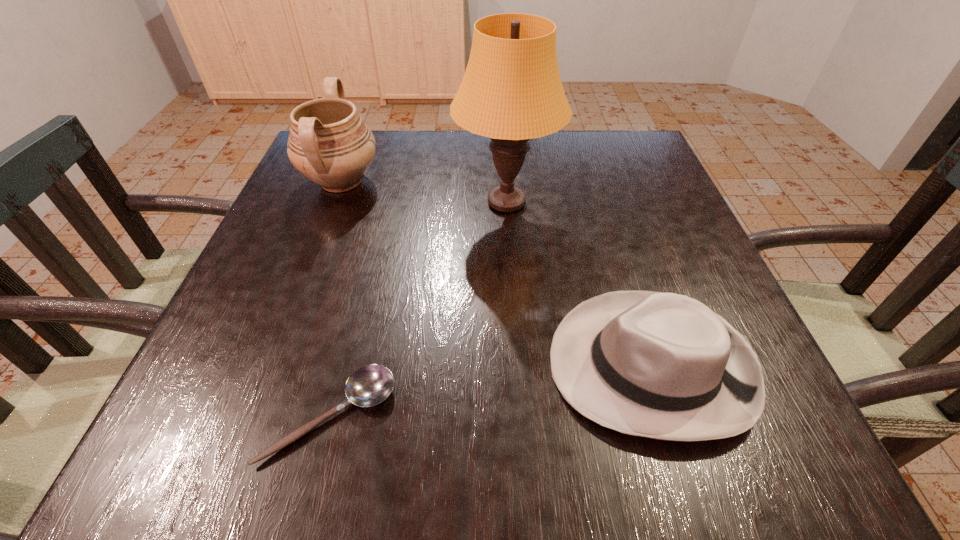
Where is `the tallest object`? the tallest object is located at coordinates (511, 92).

Where is `the second tallest object`? The width and height of the screenshot is (960, 540). the second tallest object is located at coordinates (329, 143).

Where is `fedora`? This screenshot has width=960, height=540. fedora is located at coordinates (660, 365).

In order to click on ladle in this screenshot , I will do point(369,385).

This screenshot has width=960, height=540. In order to click on free space located on the left of the tallest object in this screenshot , I will do `click(343, 202)`.

This screenshot has height=540, width=960. Find the location of `vacant point located 0.260m on the front-facing side of the third shortest object`. vacant point located 0.260m on the front-facing side of the third shortest object is located at coordinates (492, 181).

Where is `vacant area situated 0.350m on the front-facing side of the fedora`? vacant area situated 0.350m on the front-facing side of the fedora is located at coordinates (327, 366).

Locate an element on the screen. The height and width of the screenshot is (540, 960). free spot located 0.350m on the front-facing side of the fedora is located at coordinates point(327,366).

The image size is (960, 540). I want to click on free space located 0.380m on the front-facing side of the fedora, so [308, 366].

Locate an element on the screen. vacant space located on the back of the shortest object is located at coordinates (348, 345).